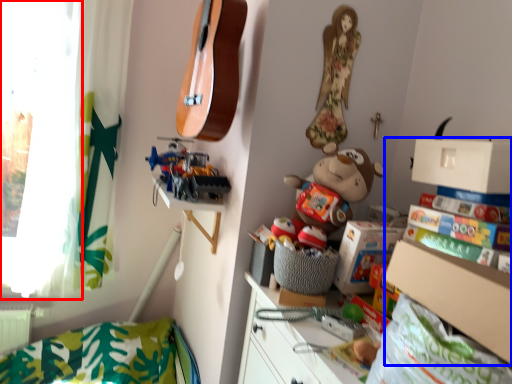
Question: Among these objects, which one is farthest to the camera, window screen (highlighted by a red box) or shelf (highlighted by a blue box)?

Choices:
 (A) window screen
 (B) shelf

Answer: (A)